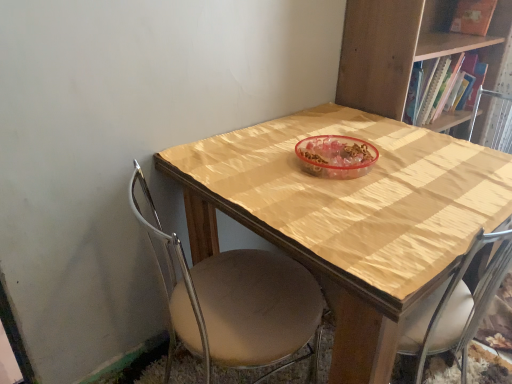
The width and height of the screenshot is (512, 384). What are the coordinates of `blank space situated above wooden table at center (from a real-world perspective)` in the screenshot? It's located at (322, 177).